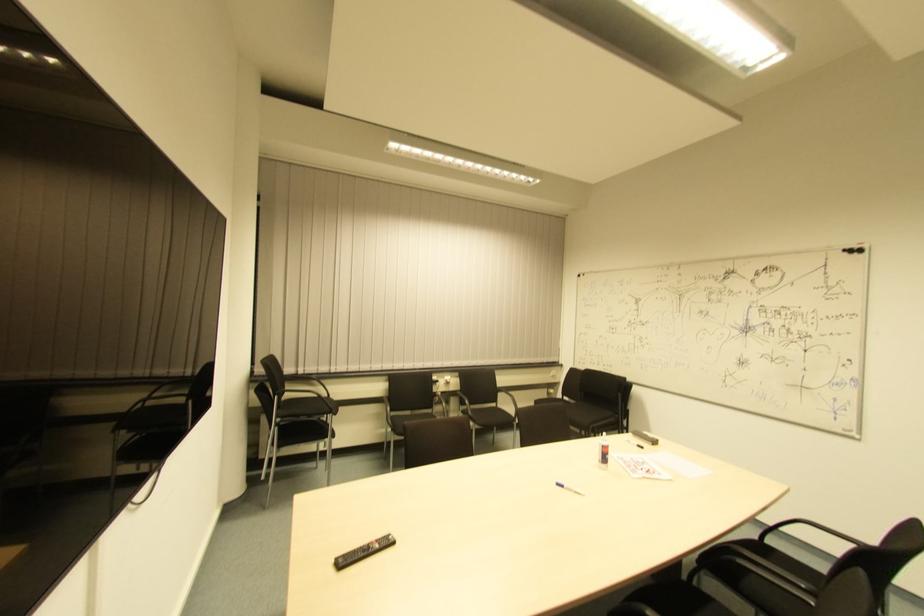
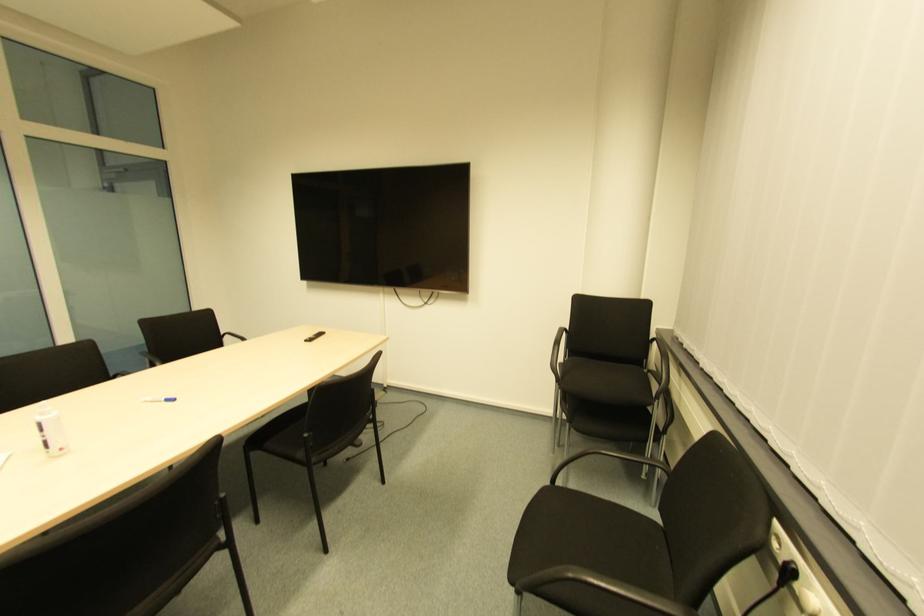
Find the pixel in the second image that matches (555,488) in the first image.

(172, 403)